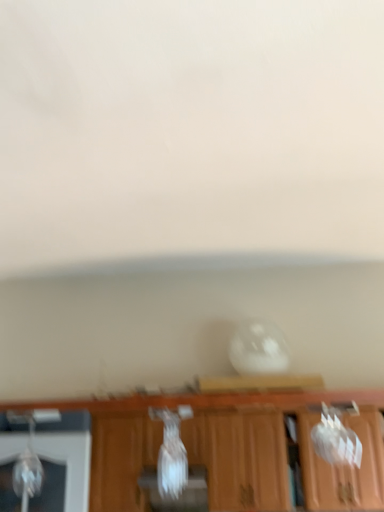
The width and height of the screenshot is (384, 512). What do you see at coordinates (215, 444) in the screenshot?
I see `wooden cabinet at center` at bounding box center [215, 444].

This screenshot has width=384, height=512. I want to click on wooden cabinet at center, so click(x=215, y=444).

Measure the distance between point (250, 481) and camera.

3.26 meters.

This screenshot has width=384, height=512. I want to click on wooden cabinet at center, so click(x=215, y=444).